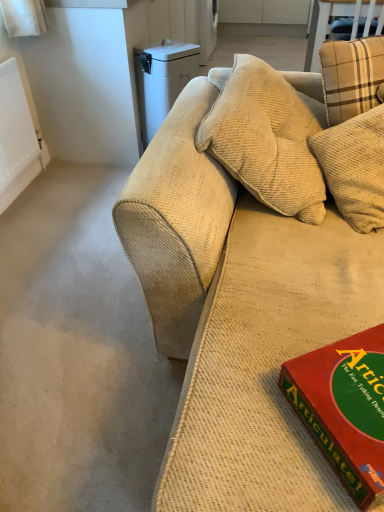
Question: Is red matte board game at lower right not inside beige corduroy couch at center?

Choices:
 (A) no
 (B) yes

Answer: (B)

Question: Is red matte board game at lower right turned away from beige corduroy couch at center?

Choices:
 (A) no
 (B) yes

Answer: (A)

Question: Is red matte board game at lower right thinner than beige corduroy couch at center?

Choices:
 (A) no
 (B) yes

Answer: (B)

Question: Is red matte board game at lower right beside beige corduroy couch at center?

Choices:
 (A) yes
 (B) no

Answer: (B)

Question: Is red matte board game at lower right positioned far away from beige corduroy couch at center?

Choices:
 (A) yes
 (B) no

Answer: (B)

Question: From the image's perspective, is white plastic trash can at upper left located above or below red matte board game at lower right?

Choices:
 (A) above
 (B) below

Answer: (A)

Question: In the image, is white plastic trash can at upper left positioned in front of or behind red matte board game at lower right?

Choices:
 (A) front
 (B) behind

Answer: (B)

Question: In terms of size, does white plastic trash can at upper left appear bigger or smaller than red matte board game at lower right?

Choices:
 (A) small
 (B) big

Answer: (B)

Question: Is white plastic trash can at upper left taller or shorter than red matte board game at lower right?

Choices:
 (A) short
 (B) tall

Answer: (B)

Question: Considering the relative positions of white plastic trash can at upper left and beige corduroy couch at center in the image provided, is white plastic trash can at upper left to the left or to the right of beige corduroy couch at center?

Choices:
 (A) right
 (B) left

Answer: (B)

Question: Is white plastic trash can at upper left bigger or smaller than beige corduroy couch at center?

Choices:
 (A) small
 (B) big

Answer: (A)

Question: From a real-world perspective, is white plastic trash can at upper left above or below beige corduroy couch at center?

Choices:
 (A) below
 (B) above

Answer: (B)

Question: In terms of width, does white plastic trash can at upper left look wider or thinner when compared to beige corduroy couch at center?

Choices:
 (A) thin
 (B) wide

Answer: (A)

Question: From the image's perspective, is red matte board game at lower right positioned above or below white plastic trash can at upper left?

Choices:
 (A) below
 (B) above

Answer: (A)

Question: Would you say red matte board game at lower right is to the left or to the right of white plastic trash can at upper left in the picture?

Choices:
 (A) left
 (B) right

Answer: (B)